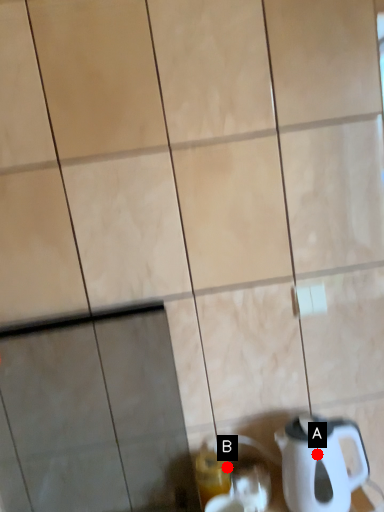
Question: Two points are circled on the image, labeled by A and B beside each circle. Which of the following is the farthest from the observer?

Choices:
 (A) A is further
 (B) B is further

Answer: (B)